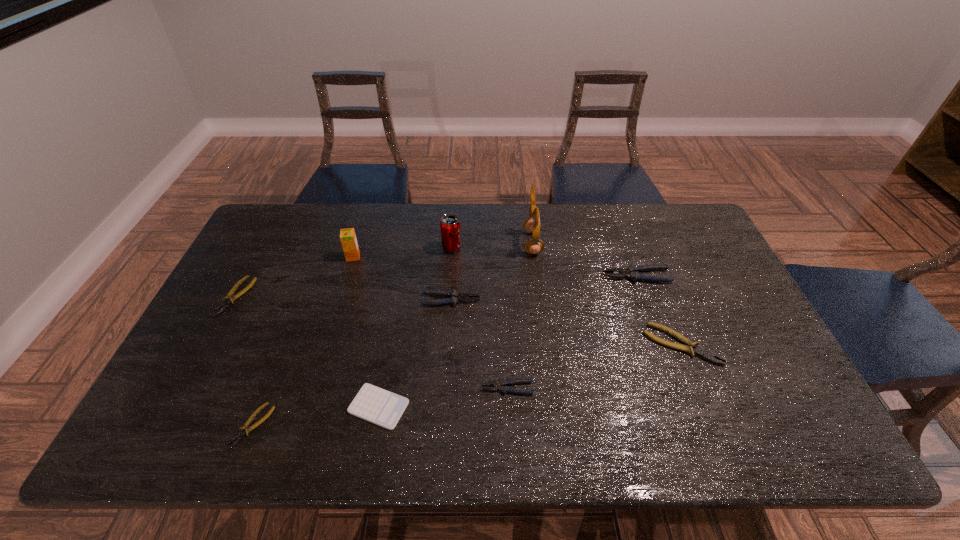
Where is `free space between the fifth tallest pliers and the sixth shortest object`? free space between the fifth tallest pliers and the sixth shortest object is located at coordinates (344, 299).

Find the location of a particular element. free spot between the second gray pliers from left to right and the leftmost object is located at coordinates (372, 342).

Where is `free spot between the third pliers from right to left and the third pliers from left to right`? This screenshot has height=540, width=960. free spot between the third pliers from right to left and the third pliers from left to right is located at coordinates (479, 344).

You are a GUI agent. You are given a task and a screenshot of the screen. Output one action in this format:
    pyautogui.click(x=<x>, y=<y>)
    Task: Click on the free space between the tallest object and the smallest gray pliers
    The width and height of the screenshot is (960, 540).
    Given the screenshot: What is the action you would take?
    pyautogui.click(x=520, y=315)

Select which object is the fifth closest to the seventh object from left to right. Please provide its 2D coordinates. Your answer should be formatted as a tuple, i.e. [(x, y)], where the tuple contains the x and y coordinates of a point satisfying the conditions above.

[(532, 225)]

This screenshot has height=540, width=960. I want to click on object that is the second nearest to the second yellow pliers from left to right, so coord(229,298).

The height and width of the screenshot is (540, 960). Find the location of `pliers that stands as the fourth closest to the soda can`. pliers that stands as the fourth closest to the soda can is located at coordinates (229, 298).

Locate which pliers ranks second in proximity to the fourth object from left to right. Please provide its 2D coordinates. Your answer should be formatted as a tuple, i.e. [(x, y)], where the tuple contains the x and y coordinates of a point satisfying the conditions above.

[(504, 383)]

Identify which gray pliers is the second closest to the biggest gray pliers. Please provide its 2D coordinates. Your answer should be formatted as a tuple, i.e. [(x, y)], where the tuple contains the x and y coordinates of a point satisfying the conditions above.

[(504, 383)]

The image size is (960, 540). I want to click on gray pliers identified as the third closest to the farthest yellow pliers, so click(x=632, y=272).